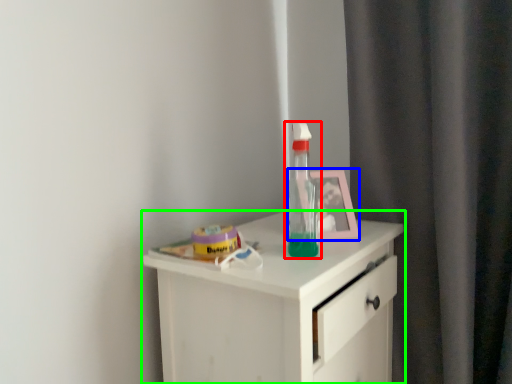
Question: Estimate the real-world distances between objects in this image. Which object is farther from bottle (highlighted by a red box), picture frame (highlighted by a blue box) or chest of drawers (highlighted by a green box)?

Choices:
 (A) picture frame
 (B) chest of drawers

Answer: (B)